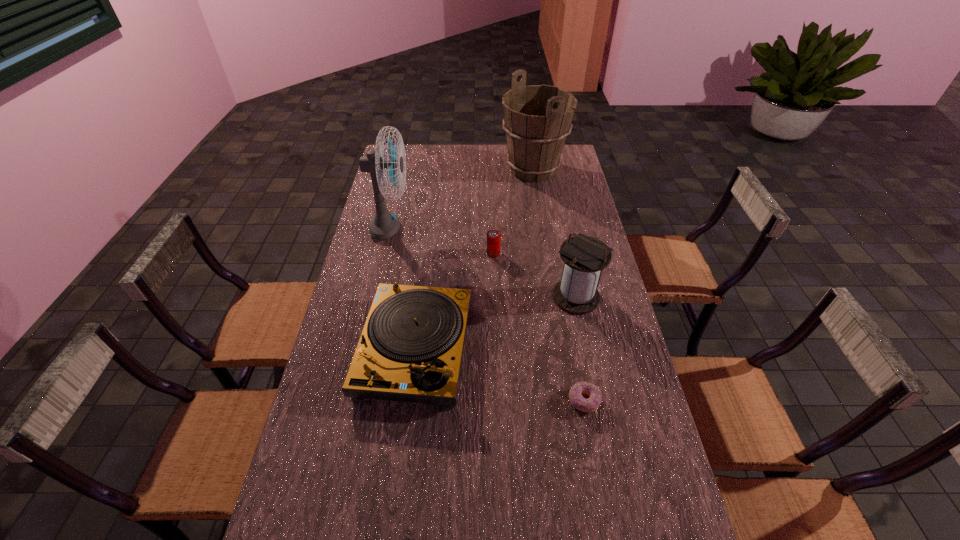
Locate an element on the screen. The width and height of the screenshot is (960, 540). fan is located at coordinates (384, 224).

Where is `bucket`? bucket is located at coordinates (537, 119).

The image size is (960, 540). In order to click on the fourth shortest object in this screenshot , I will do `click(584, 257)`.

Where is `the third shortest object`? The image size is (960, 540). the third shortest object is located at coordinates (410, 350).

Find the location of a particular element. This screenshot has width=960, height=540. the third object from left to right is located at coordinates (493, 236).

Identify the location of can. This screenshot has height=540, width=960. (493, 236).

Image resolution: width=960 pixels, height=540 pixels. What are the coordinates of `the shortest object` in the screenshot? It's located at (591, 404).

You are a GUI agent. You are given a task and a screenshot of the screen. Output one action in this format:
    pyautogui.click(x=<x>, y=<y>)
    Task: Click on the vacant region located 0.170m on the front-facing side of the fan
    This screenshot has height=540, width=960.
    Given the screenshot: What is the action you would take?
    pyautogui.click(x=454, y=230)

At what (x,y) coordinates should I click in order to perform the action: click on vacant space positioned on the left of the farthest object. Please return your answer as a coordinate pair (x, y). The height and width of the screenshot is (540, 960). Looking at the image, I should click on (428, 170).

The height and width of the screenshot is (540, 960). Identify the location of blank space located on the front of the third tallest object. (598, 404).